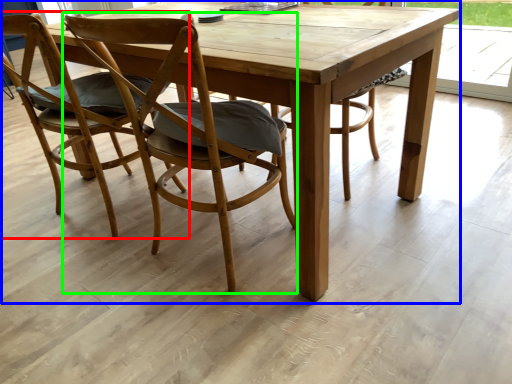
Question: Considering the real-world distances, which object is closest to chair (highlighted by a red box)? picnic table (highlighted by a blue box) or chair (highlighted by a green box).

Choices:
 (A) picnic table
 (B) chair

Answer: (B)